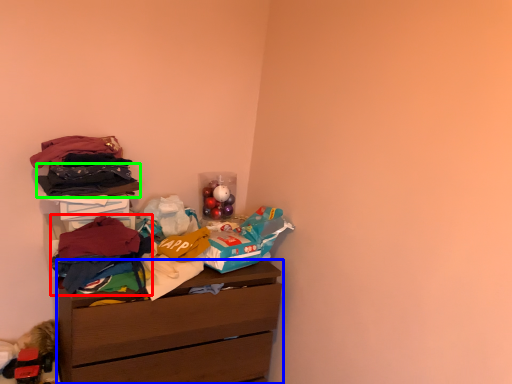
Question: Which is nearer to the clothing (highlighted by a red box)? chest of drawers (highlighted by a blue box) or clothing (highlighted by a green box).

Choices:
 (A) chest of drawers
 (B) clothing

Answer: (B)